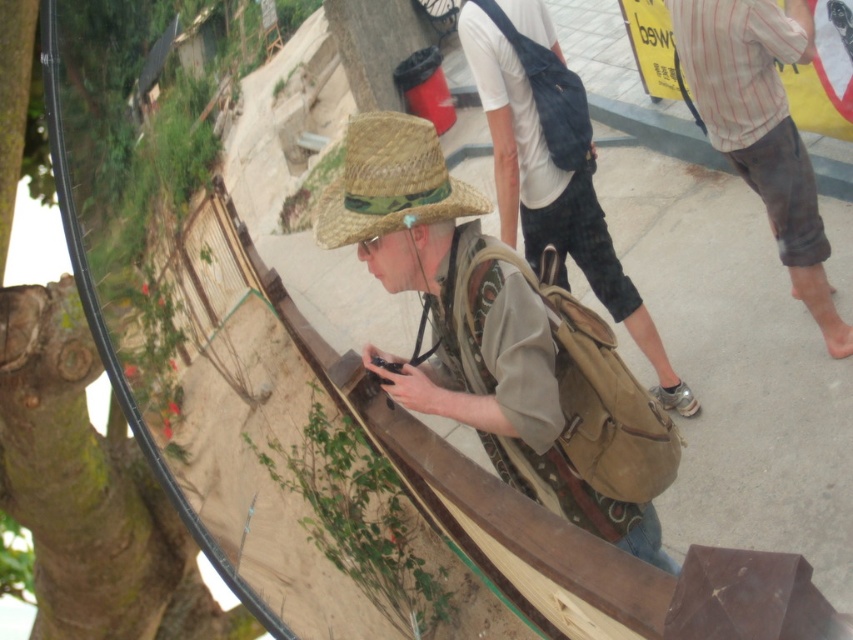
Is striped cotton shirt at upper right taller than strawhat at center?

Yes.

Which of these two, striped cotton shirt at upper right or strawhat at center, stands taller?

Standing taller between the two is striped cotton shirt at upper right.

You are a GUI agent. You are given a task and a screenshot of the screen. Output one action in this format:
    pyautogui.click(x=<x>, y=<y>)
    Task: Click on the striped cotton shirt at upper right
    The image size is (853, 640).
    Given the screenshot: What is the action you would take?
    pyautogui.click(x=762, y=128)

In the scene shown: Is green rough bark tree at left wider than striped cotton shirt at upper right?

Yes.

Measure the distance between green rough bark tree at left and striped cotton shirt at upper right.

They are 9.79 feet apart.

You are a GUI agent. You are given a task and a screenshot of the screen. Output one action in this format:
    pyautogui.click(x=<x>, y=<y>)
    Task: Click on the green rough bark tree at left
    The width and height of the screenshot is (853, 640).
    Given the screenshot: What is the action you would take?
    pyautogui.click(x=90, y=504)

Where is `green rough bark tree at left`? green rough bark tree at left is located at coordinates (90, 504).

Who is shorter, green rough bark tree at left or matte brown backpack at center?

matte brown backpack at center is shorter.

Looking at this image, can you confirm if green rough bark tree at left is positioned below matte brown backpack at center?

Indeed, green rough bark tree at left is positioned under matte brown backpack at center.

Identify the location of green rough bark tree at left. The width and height of the screenshot is (853, 640). (90, 504).